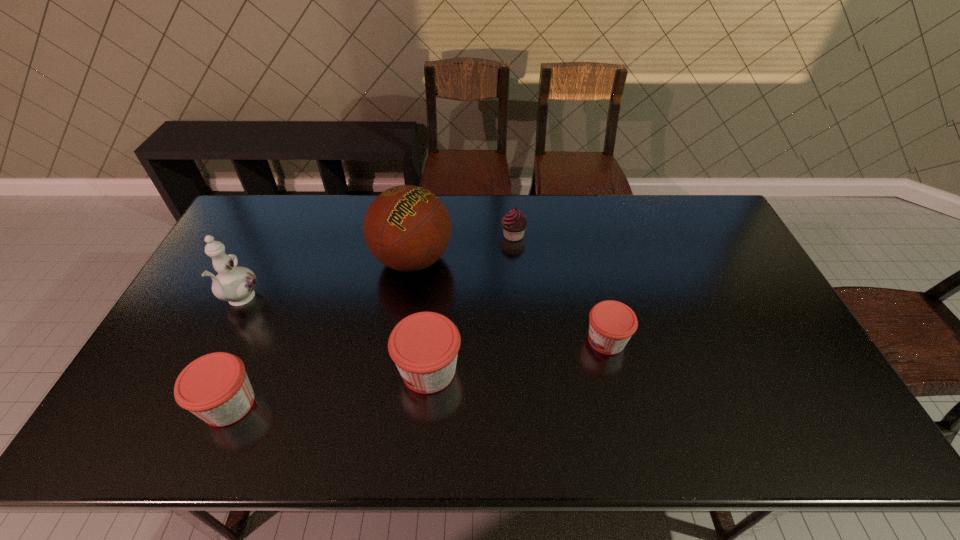
Locate an element on the screen. The width and height of the screenshot is (960, 540). the second shortest jam is located at coordinates (215, 387).

You are a GUI agent. You are given a task and a screenshot of the screen. Output one action in this format:
    pyautogui.click(x=<x>, y=<y>)
    Task: Click on the second jam from right to left
    
    Given the screenshot: What is the action you would take?
    pyautogui.click(x=424, y=346)

You are a GUI agent. You are given a task and a screenshot of the screen. Output one action in this format:
    pyautogui.click(x=<x>, y=<y>)
    Task: Click on the shortest jam
    
    Given the screenshot: What is the action you would take?
    pyautogui.click(x=612, y=323)

This screenshot has width=960, height=540. Find the location of `the rightmost jam`. the rightmost jam is located at coordinates (612, 323).

Where is `basketball`? basketball is located at coordinates (407, 228).

Where is `chinaware`? chinaware is located at coordinates tap(235, 284).

This screenshot has height=540, width=960. I want to click on cupcake, so click(514, 223).

Image resolution: width=960 pixels, height=540 pixels. Find the location of `blank area located on the front label of the second tallest jam`. blank area located on the front label of the second tallest jam is located at coordinates (133, 404).

Where is `free location located 0.100m on the front label of the second tallest jam`? The height and width of the screenshot is (540, 960). free location located 0.100m on the front label of the second tallest jam is located at coordinates [x=157, y=404].

This screenshot has width=960, height=540. What are the coordinates of `vacant space positioned on the front label of the second tallest jam` in the screenshot? It's located at (137, 404).